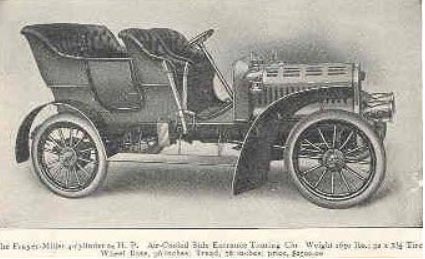
Locate an element on the screen. This screenshot has height=259, width=425. seat is located at coordinates (57, 35), (156, 38), (173, 37).